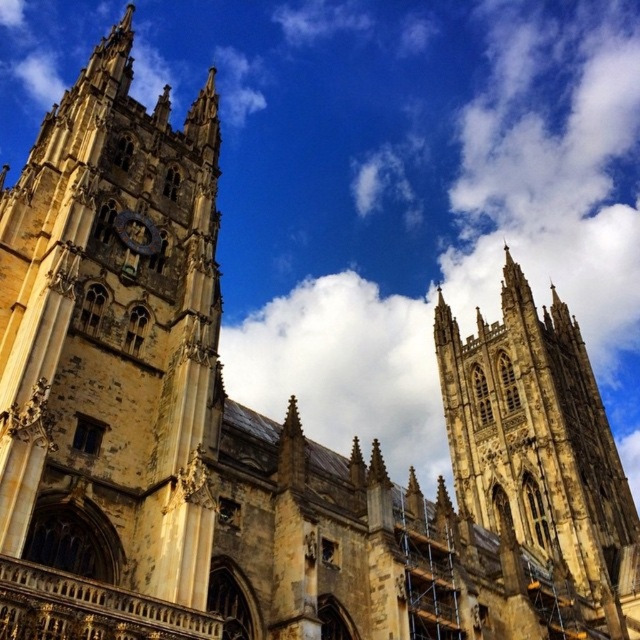
Question: Which point is farther from the camera taking this photo?

Choices:
 (A) (152, 236)
 (B) (51, 534)

Answer: (A)

Question: Does yellow stone tower at center appear under gold metallic clock at center?

Choices:
 (A) no
 (B) yes

Answer: (B)

Question: Can you confirm if yellow stone tower at center is bigger than gold metallic clock at center?

Choices:
 (A) yes
 (B) no

Answer: (A)

Question: Is yellow stone tower at left wider than yellow stone tower at center?

Choices:
 (A) yes
 (B) no

Answer: (B)

Question: Among these points, which one is farthest from the camera?

Choices:
 (A) (124, 205)
 (B) (125, 221)
 (C) (564, 384)

Answer: (C)

Question: Considering the real-world distances, which object is closest to the gold metallic clock at center?

Choices:
 (A) yellow stone tower at left
 (B) yellow stone tower at center

Answer: (A)